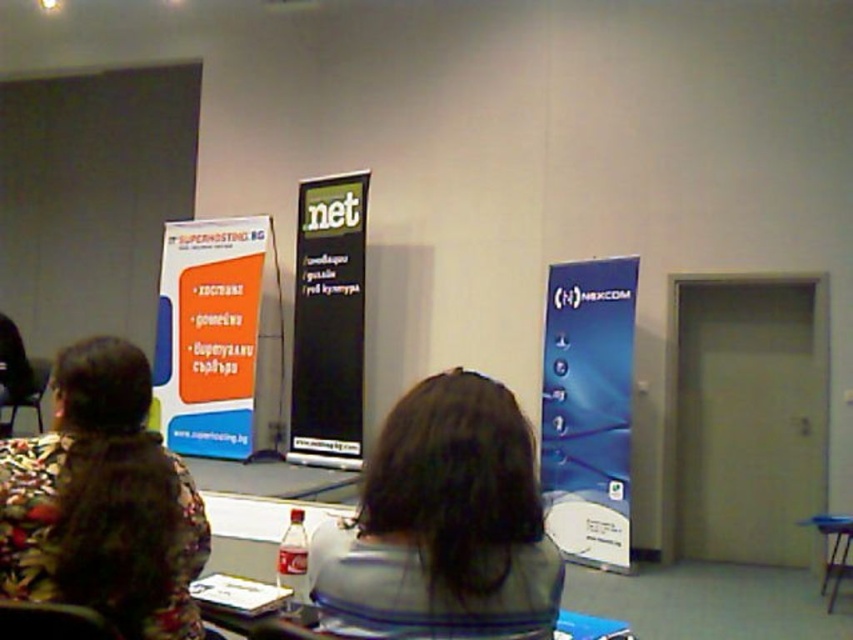
Consider the image. Does blue glossy banner at right have a lesser height compared to black glossy projection screen at center?

Yes, blue glossy banner at right is shorter than black glossy projection screen at center.

Between blue glossy banner at right and black glossy projection screen at center, which one appears on the left side from the viewer's perspective?

From the viewer's perspective, black glossy projection screen at center appears more on the left side.

Does point (592, 477) come behind point (311, 442)?

No, (592, 477) is in front of (311, 442).

Where is `blue glossy banner at right`? The height and width of the screenshot is (640, 853). blue glossy banner at right is located at coordinates (589, 406).

Can you confirm if gray fabric shirt at center is positioned above floral fabric jacket at left?

Correct, gray fabric shirt at center is located above floral fabric jacket at left.

I want to click on gray fabric shirt at center, so click(x=444, y=525).

Where is `gray fabric shirt at center`? gray fabric shirt at center is located at coordinates (444, 525).

Find the location of a particular element. gray fabric shirt at center is located at coordinates (444, 525).

Who is positioned more to the right, floral fabric jacket at left or black glossy projection screen at center?

Positioned to the right is floral fabric jacket at left.

Between floral fabric jacket at left and black glossy projection screen at center, which one has less height?

floral fabric jacket at left is shorter.

You are a GUI agent. You are given a task and a screenshot of the screen. Output one action in this format:
    pyautogui.click(x=<x>, y=<y>)
    Task: Click on the floral fabric jacket at left
    The image size is (853, 640).
    Given the screenshot: What is the action you would take?
    pyautogui.click(x=102, y=500)